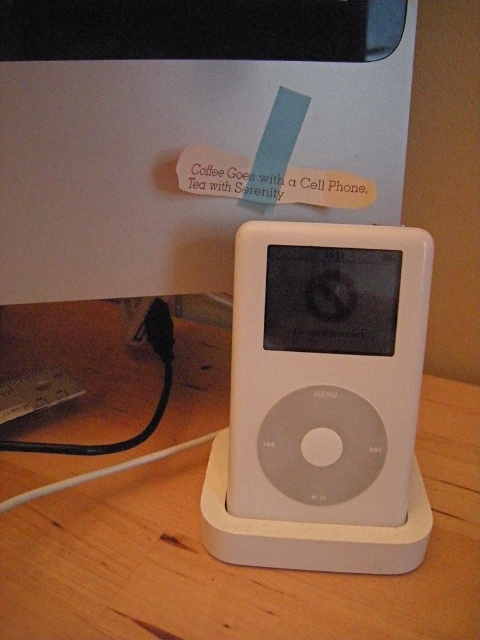
You are standing in front of the iPod dock and want to place a small sticker on either the point at location [180,512] or the point at [412,289]. Which point is closer to you?

Point at location [180,512] is closer to you because it is further to the viewer than point at [412,289].